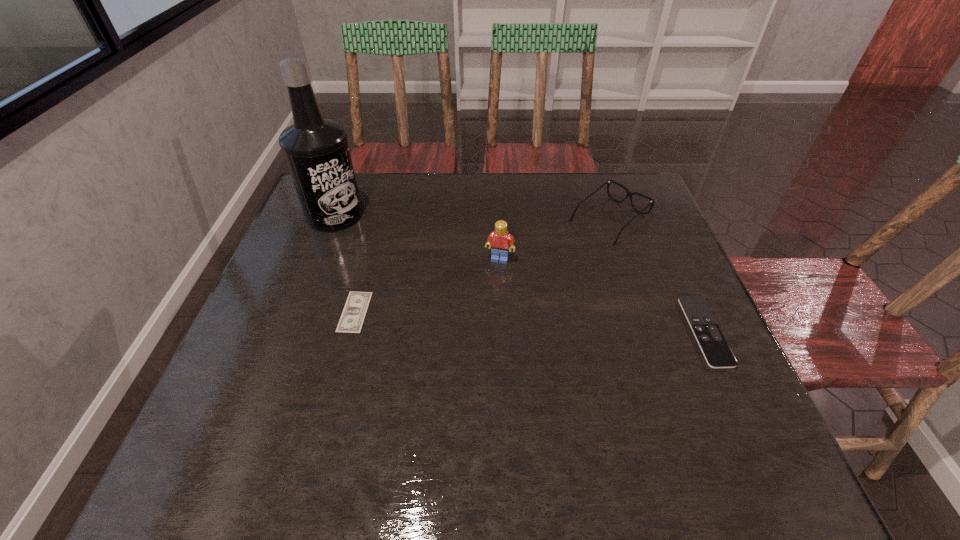
Find the location of a particular element. The width and height of the screenshot is (960, 540). liquor positioned at the far edge is located at coordinates (316, 150).

Find the location of a particular element. The height and width of the screenshot is (540, 960). object located at the left edge is located at coordinates (316, 150).

Where is `remote control at the right edge`? remote control at the right edge is located at coordinates (714, 347).

Where is `spectacles that is at the right edge`? The image size is (960, 540). spectacles that is at the right edge is located at coordinates (629, 194).

Image resolution: width=960 pixels, height=540 pixels. What are the coordinates of `object that is positioned at the far left corner` in the screenshot? It's located at (316, 150).

The width and height of the screenshot is (960, 540). I want to click on object situated at the far right corner, so click(629, 194).

In the image, there is a desktop. At what (x,y) coordinates should I click in order to perform the action: click on vacant space at the far edge. Please return your answer as a coordinate pair (x, y). This screenshot has width=960, height=540. Looking at the image, I should click on (420, 177).

The image size is (960, 540). Identify the location of vacant space at the left edge of the desktop. (293, 266).

I want to click on free space at the right edge of the desktop, so click(654, 320).

Identify the location of vacant space at the far right corner of the desktop. (658, 210).